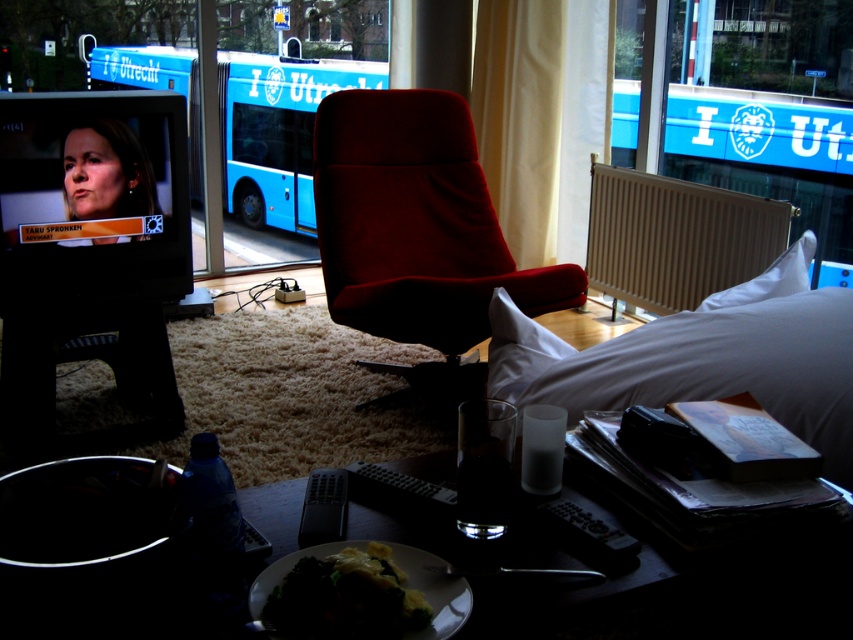
Question: Which point is farther from the camera taking this photo?

Choices:
 (A) (137, 193)
 (B) (300, 74)
 (C) (531, 321)
 (D) (427, 150)

Answer: (B)

Question: Does matte black face at left appear on the left side of white soft pillow at upper right?

Choices:
 (A) yes
 (B) no

Answer: (A)

Question: Can you confirm if blue metallic bus at center is thinner than white soft pillow at upper right?

Choices:
 (A) no
 (B) yes

Answer: (A)

Question: Which of these objects is positioned farthest from the matte black face at left?

Choices:
 (A) white matte bed at lower right
 (B) white soft pillow at upper right

Answer: (B)

Question: Which point appears closest to the camera in this image?

Choices:
 (A) pos(172,58)
 (B) pos(337,611)

Answer: (B)

Question: Is beige metallic radiator at right above white soft pillow at upper right?

Choices:
 (A) no
 (B) yes

Answer: (B)